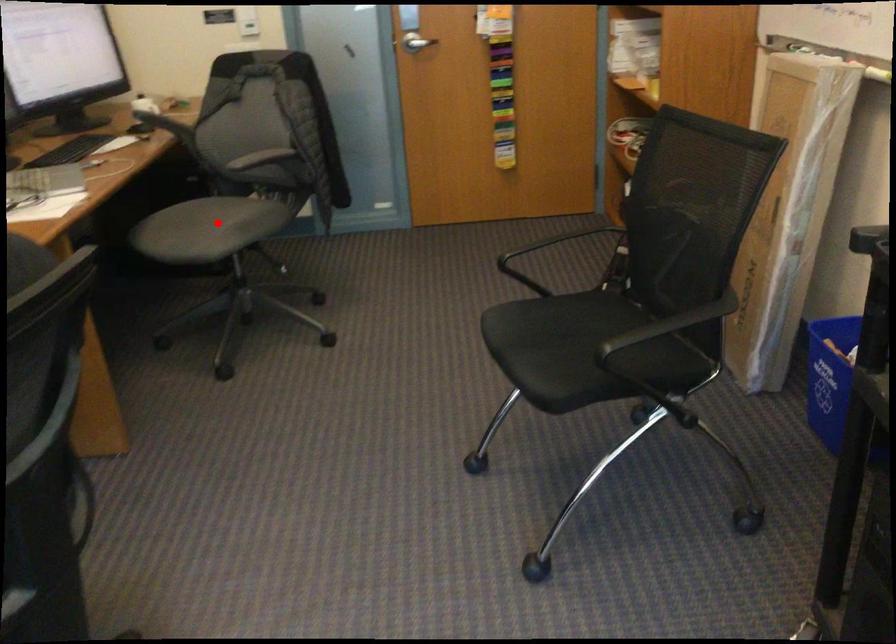
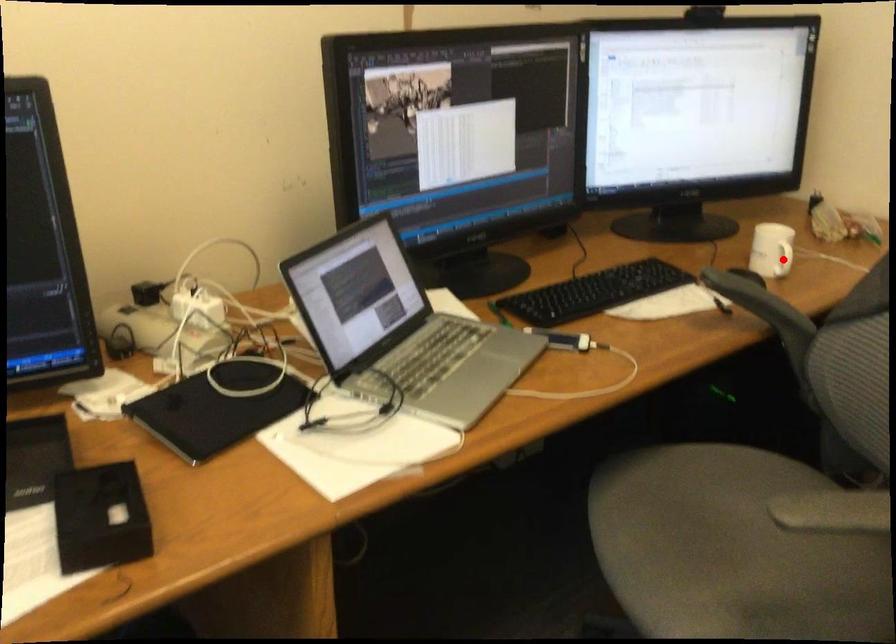
I am providing you with two images of the same scene from different viewpoints. A red point is marked on the first image and another point is marked on the second image. Do the highlighted points in image1 and image2 indicate the same real-world spot?

No